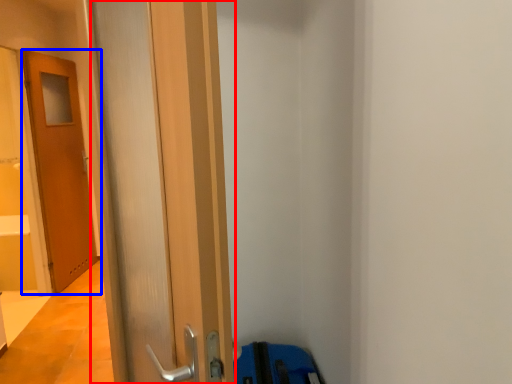
Question: Which point is further to the camera, door (highlighted by a red box) or door (highlighted by a blue box)?

Choices:
 (A) door
 (B) door

Answer: (B)